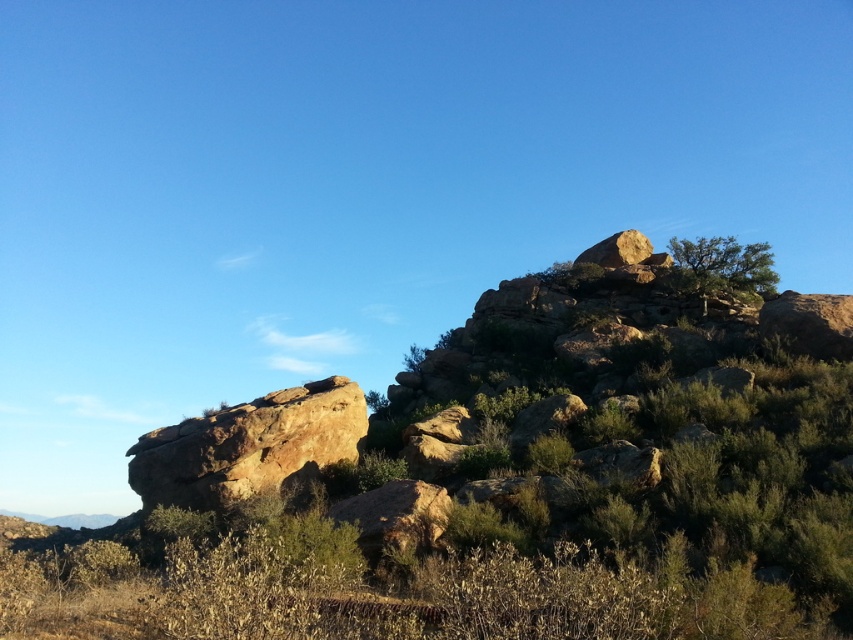
Between brown rough rock at center and rustic brown rock at upper right, which one is positioned lower?

brown rough rock at center is below.

At what (x,y) coordinates should I click in order to perform the action: click on brown rough rock at center. Please return your answer as a coordinate pair (x, y). The width and height of the screenshot is (853, 640). Looking at the image, I should click on (248, 445).

The width and height of the screenshot is (853, 640). Identify the location of brown rough rock at center. (248, 445).